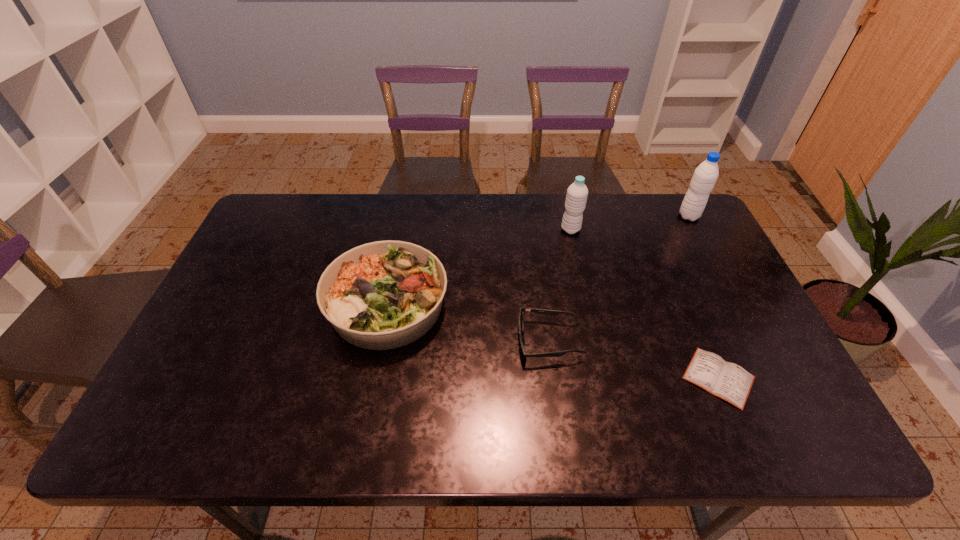
This screenshot has width=960, height=540. Identify the location of vacant space located 0.100m on the left of the right water bottle. click(x=648, y=216).

Find the location of a particular element. The image size is (960, 540). vacant space situated on the right of the shorter water bottle is located at coordinates (701, 230).

The width and height of the screenshot is (960, 540). In order to click on vacant space located on the back of the salad plate in this screenshot , I will do `click(405, 215)`.

What are the coordinates of `vacant space located 0.290m on the front-facing side of the sunglasses` in the screenshot? It's located at (404, 341).

Locate an element on the screen. Image resolution: width=960 pixels, height=540 pixels. free location located on the front-facing side of the sunglasses is located at coordinates (376, 341).

In order to click on vacant space located 0.160m on the front-facing side of the sunglasses in this screenshot , I will do `click(455, 341)`.

I want to click on free space located on the left of the fourth object from left to right, so click(653, 377).

The height and width of the screenshot is (540, 960). What are the coordinates of `object at the near edge` in the screenshot? It's located at (728, 381).

This screenshot has width=960, height=540. I want to click on water bottle that is at the right edge, so click(x=705, y=176).

Identify the location of diary situated at the right edge. (728, 381).